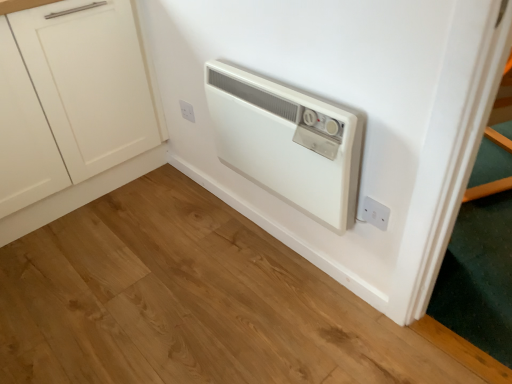
I want to click on vacant space underneath white plastic heater at center (from a real-world perspective), so click(x=281, y=248).